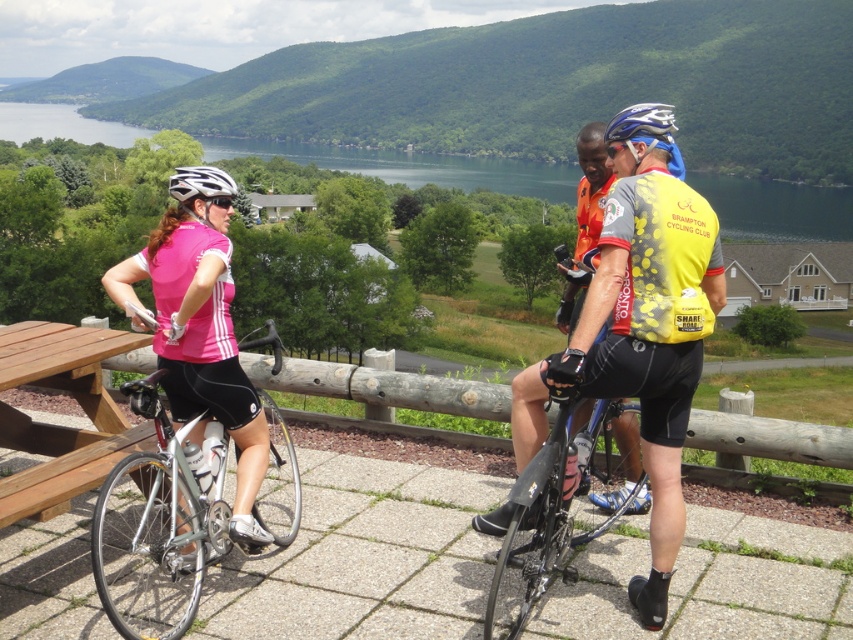
You are a cyclist standing at the wooden railing overlooking the green water at upper center. You need to secure your silver metallic bicycle at left. Which direction should you move to reach your bicycle?

The silver metallic bicycle at left is located below the green water at upper center, so you should move downward from the green water at upper center to reach the silver metallic bicycle at left.

You are one of the cyclists needing to place your backpack on a surface. Which object from the wooden picnic table at lower left and the shiny black bicycle at center is higher?

The wooden picnic table at lower left is positioned over the shiny black bicycle at center, meaning it is higher than the bicycle.

What object is located at the point with coordinates (157, 525)?

The point at coordinates (157, 525) is on the silver metallic bicycle at left.